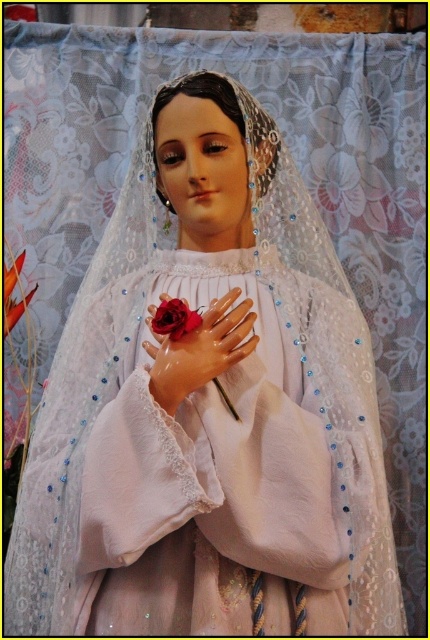
You are an art conservator examining the statue. You need to locate the matte porcelain hand at center to apply a protective coating. According to the coordinates provided, where exactly should you apply the coating?

You should apply the protective coating at point (199, 349) where the matte porcelain hand at center is located.

In the scene shown: You are an artist trying to sketch the statue. You notice two points on the statue. The first point is at coordinate point (165, 376), and the second point is at coordinate point (156, 321). Which point is closer to the viewer?

Point (156, 321) is closer to the viewer because it is in front of point (165, 376).